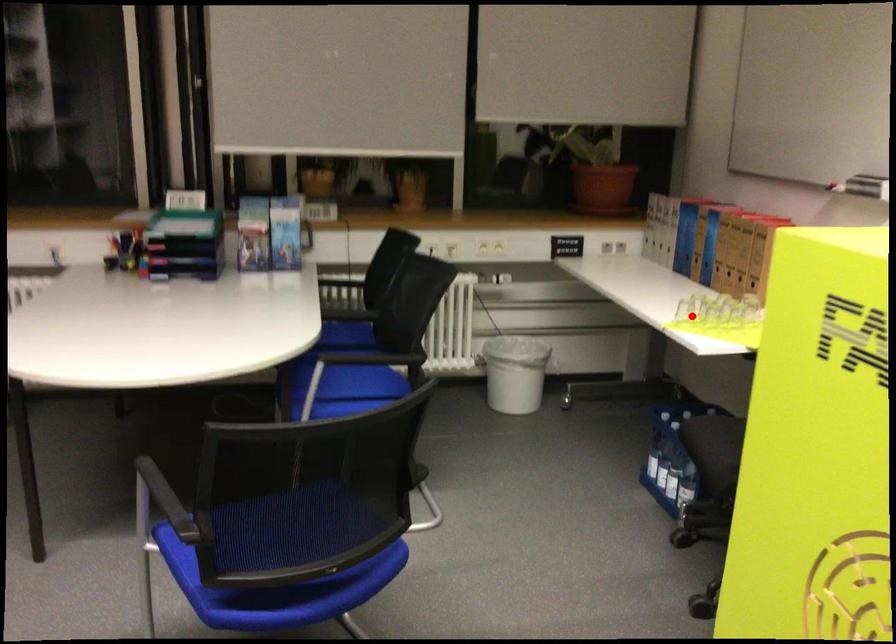
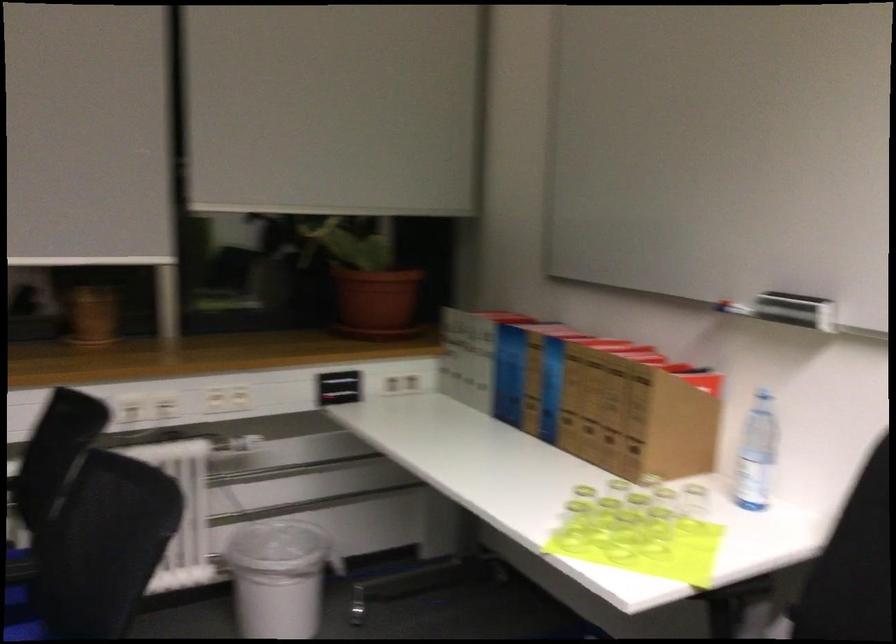
Question: I am providing you with two images of the same scene from different viewpoints. Image1 has a red point marked. In image2, the corresponding 3D location appears at what relative position? Reply with the corresponding letter.

Choices:
 (A) Closer
 (B) Farther

Answer: (A)